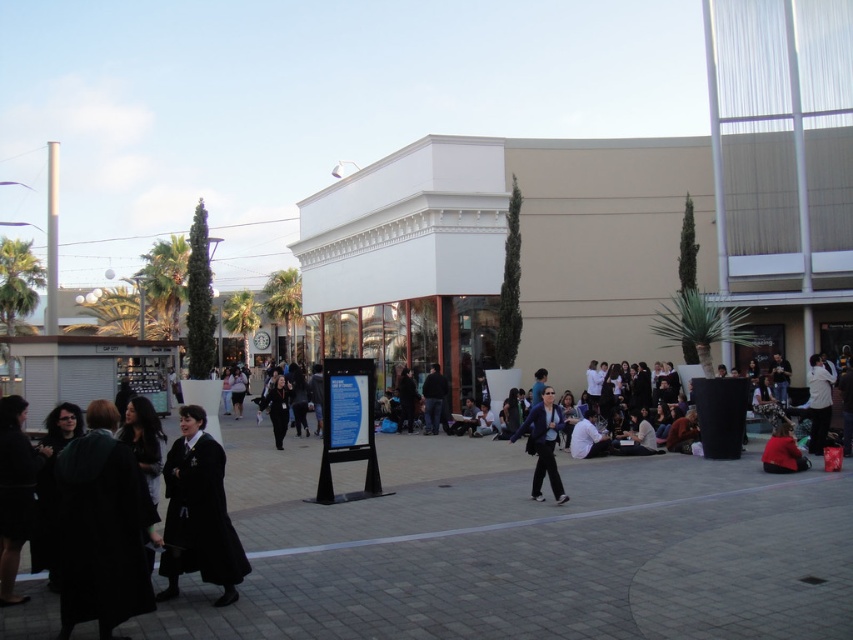
You are standing at the entrance of the building and want to find the matte blue jacket at center. According to the coordinates provided, in which direction should you walk to locate it?

The matte blue jacket at center is located at coordinates point [543,444], so you should walk towards the center of the scene from the entrance to find it.